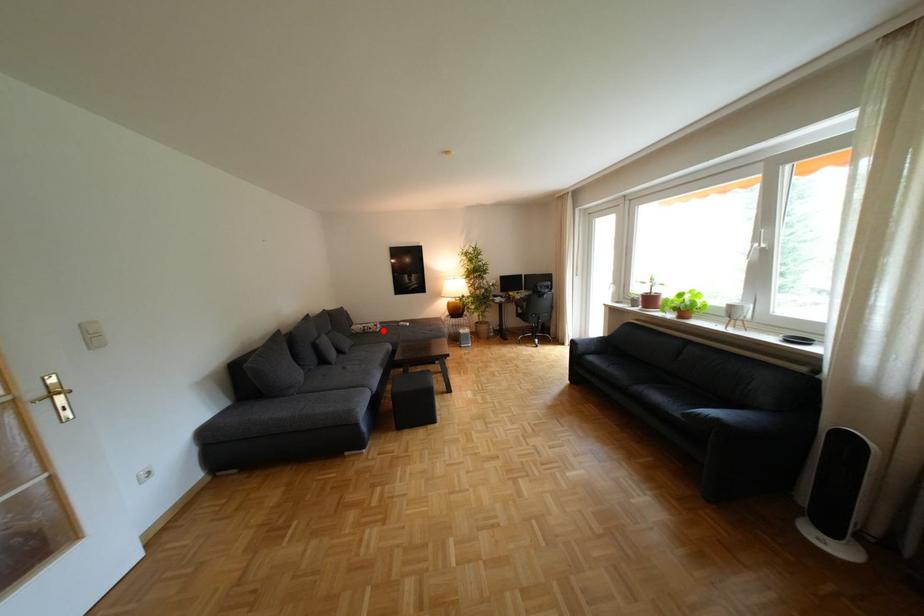
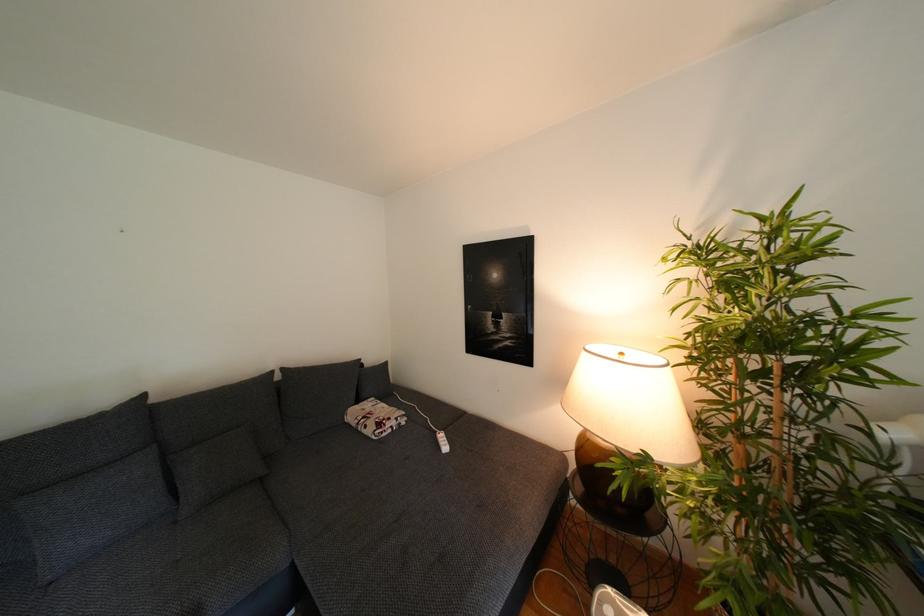
Question: I am providing you with two images of the same scene from different viewpoints. A red point is shown in image1. For the corresponding object point in image2, is it positioned nearer or farther from the camera?

Choices:
 (A) Nearer
 (B) Farther

Answer: (B)